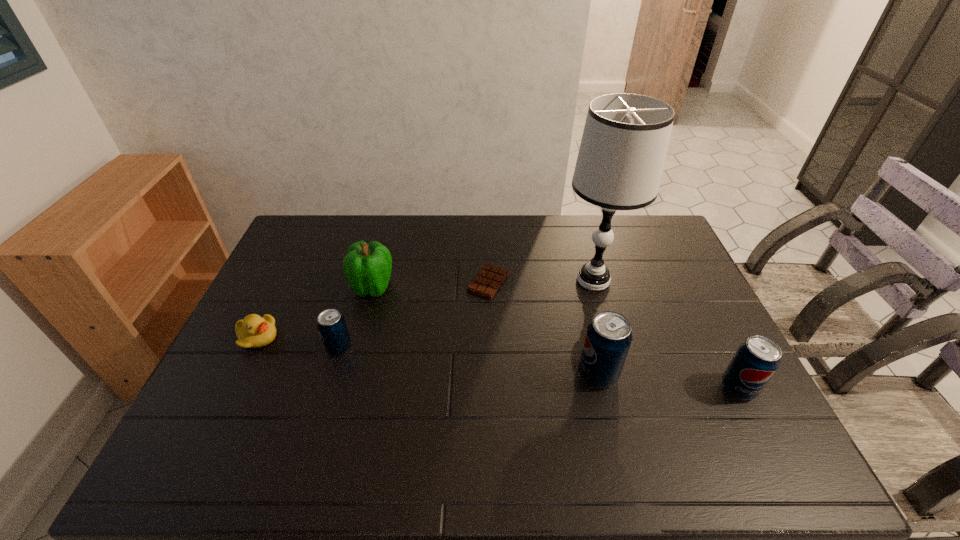
At what (x,y) coordinates should I click in order to perform the action: click on the shortest soda can. Please return your answer as a coordinate pair (x, y). This screenshot has height=540, width=960. Looking at the image, I should click on (331, 324).

Identify the location of the leftmost soda can. The width and height of the screenshot is (960, 540). (331, 324).

Find the location of a particular element. The image size is (960, 540). the second soda can from right to left is located at coordinates (608, 338).

The width and height of the screenshot is (960, 540). I want to click on the rightmost soda can, so click(756, 360).

You are a GUI agent. You are given a task and a screenshot of the screen. Output one action in this format:
    pyautogui.click(x=<x>, y=<y>)
    Task: Click on the rightmost object
    Image resolution: width=960 pixels, height=540 pixels.
    Given the screenshot: What is the action you would take?
    pyautogui.click(x=756, y=360)

Where is `the tallest object`? Image resolution: width=960 pixels, height=540 pixels. the tallest object is located at coordinates (624, 144).

Where is `bell pepper`? bell pepper is located at coordinates (367, 267).

Where is `the shortest object`? The image size is (960, 540). the shortest object is located at coordinates (486, 283).

Locate an element on the screen. Image resolution: width=960 pixels, height=540 pixels. the fourth object from right to left is located at coordinates (486, 283).

Locate an element on the screen. This screenshot has width=960, height=540. the leftmost object is located at coordinates (254, 331).